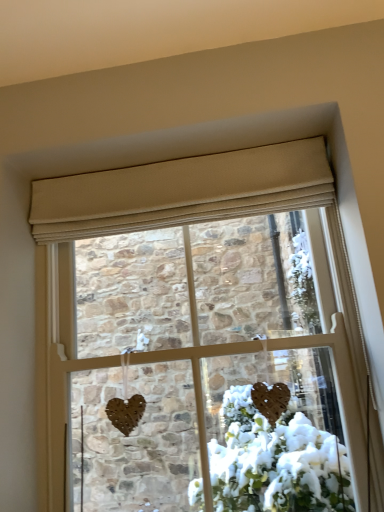
Locate an element on the screen. This screenshot has width=384, height=512. beige fabric curtain at upper center is located at coordinates (182, 191).

The image size is (384, 512). What do you see at coordinates (182, 191) in the screenshot?
I see `beige fabric curtain at upper center` at bounding box center [182, 191].

Based on the photo, what is the approximate width of matte brown heart at center?

matte brown heart at center is 8.28 inches in width.

Image resolution: width=384 pixels, height=512 pixels. Describe the element at coordinates (167, 211) in the screenshot. I see `matte brown heart at center` at that location.

At what (x,y) coordinates should I click in order to perform the action: click on matte brown heart at center. Please return your answer as a coordinate pair (x, y). The width and height of the screenshot is (384, 512). Looking at the image, I should click on (167, 211).

In order to face matte brown heart at center, should I rotate leftwards or rightwards?

Rotate your view right by about 0.281°.

This screenshot has width=384, height=512. I want to click on beige fabric curtain at upper center, so click(x=182, y=191).

Does matte brown heart at center appear on the right side of beige fabric curtain at upper center?

Indeed, matte brown heart at center is positioned on the right side of beige fabric curtain at upper center.

Who is more distant, matte brown heart at center or beige fabric curtain at upper center?

beige fabric curtain at upper center is further away from the camera.

Is point (57, 301) farther from viewer compared to point (180, 194)?

Yes.

From the image's perspective, does matte brown heart at center appear higher than beige fabric curtain at upper center?

Incorrect, from the image's perspective, matte brown heart at center is lower than beige fabric curtain at upper center.

From a real-world perspective, is matte brown heart at center above or below beige fabric curtain at upper center?

From a real-world perspective, matte brown heart at center is physically below beige fabric curtain at upper center.

Is matte brown heart at center thinner than beige fabric curtain at upper center?

No.

Can you confirm if matte brown heart at center is shorter than beige fabric curtain at upper center?

No.

Who is smaller, matte brown heart at center or beige fabric curtain at upper center?

With smaller size is beige fabric curtain at upper center.

Which is correct: matte brown heart at center is inside beige fabric curtain at upper center, or outside of it?

matte brown heart at center lies outside beige fabric curtain at upper center.

Is matte brown heart at center positioned far away from beige fabric curtain at upper center?

They are positioned close to each other.

Is matte brown heart at center turned away from beige fabric curtain at upper center?

That's not correct — matte brown heart at center is not looking away from beige fabric curtain at upper center.

Can you tell me how much matte brown heart at center and beige fabric curtain at upper center differ in facing direction?

0.000556 degrees separate the facing orientations of matte brown heart at center and beige fabric curtain at upper center.

The width and height of the screenshot is (384, 512). What are the coordinates of `window that is below the beige fabric curtain at upper center (from the image's perspective)` in the screenshot? It's located at [x=167, y=211].

Does beige fabric curtain at upper center appear on the left side of matte brown heart at center?

Yes.

Is beige fabric curtain at upper center in front of or behind matte brown heart at center in the image?

beige fabric curtain at upper center is behind matte brown heart at center.

Considering the positions of point (178, 223) and point (200, 349), is point (178, 223) closer or farther from the camera than point (200, 349)?

Point (178, 223) is farther from the camera than point (200, 349).

From the image's perspective, is beige fabric curtain at upper center located above or below matte brown heart at center?

beige fabric curtain at upper center is above matte brown heart at center.

From a real-world perspective, is beige fabric curtain at upper center below matte brown heart at center?

No, from a real-world perspective, beige fabric curtain at upper center is not below matte brown heart at center.

Is beige fabric curtain at upper center thinner than matte brown heart at center?

Indeed, beige fabric curtain at upper center has a lesser width compared to matte brown heart at center.

Between beige fabric curtain at upper center and matte brown heart at center, which one has less height?

beige fabric curtain at upper center.

Is beige fabric curtain at upper center smaller than matte brown heart at center?

Indeed, beige fabric curtain at upper center has a smaller size compared to matte brown heart at center.

Do you think beige fabric curtain at upper center is within matte brown heart at center, or outside of it?

The correct answer is: outside.

Would you say beige fabric curtain at upper center is a long distance from matte brown heart at center?

No, beige fabric curtain at upper center is not far from matte brown heart at center.

Is beige fabric curtain at upper center oriented towards matte brown heart at center?

No, beige fabric curtain at upper center does not turn towards matte brown heart at center.

How many degrees apart are the facing directions of beige fabric curtain at upper center and matte brown heart at center?

The facing directions of beige fabric curtain at upper center and matte brown heart at center are 0.000556 degrees apart.

I want to click on curtain located behind the matte brown heart at center, so (x=182, y=191).

Locate an element on the screen. Image resolution: width=384 pixels, height=512 pixels. curtain lying above the matte brown heart at center (from the image's perspective) is located at coordinates (182, 191).

Image resolution: width=384 pixels, height=512 pixels. I want to click on window directly beneath the beige fabric curtain at upper center (from a real-world perspective), so pos(167,211).